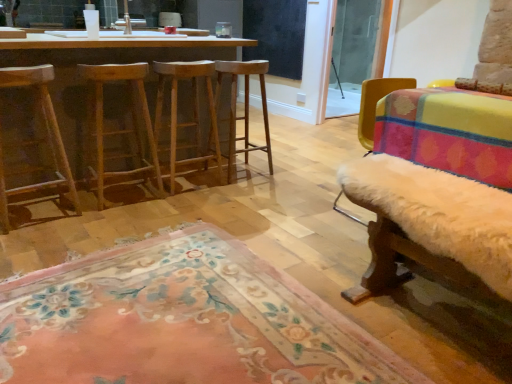
From the picture: What is the approximate height of wooden stool at center, placed as the 3th stool when sorted from left to right?

32.11 inches.

Describe the element at coordinates (244, 107) in the screenshot. I see `wooden stool at center, marked as the first stool in a right-to-left arrangement` at that location.

The height and width of the screenshot is (384, 512). What do you see at coordinates (276, 34) in the screenshot?
I see `black matte window screen at upper center` at bounding box center [276, 34].

What is the approximate height of light brown wood stool at center, which is the 2th stool in right-to-left order?

light brown wood stool at center, which is the 2th stool in right-to-left order, is 32.01 inches tall.

In order to click on wooden stool at center, marked as the first stool in a right-to-left arrangement in this screenshot , I will do `click(244, 107)`.

At what (x,y) coordinates should I click in order to perform the action: click on the 3rd stool to the left of the black matte window screen at upper center, counting from the anchor's position. Please return your answer as a coordinate pair (x, y). The width and height of the screenshot is (512, 384). Looking at the image, I should click on (119, 129).

Looking at the image, does black matte window screen at upper center seem bigger or smaller compared to natural wood stool at center, acting as the first stool starting from the left?

In the image, black matte window screen at upper center appears to be smaller than natural wood stool at center, acting as the first stool starting from the left.

From the image's perspective, who appears lower, black matte window screen at upper center or natural wood stool at center, acting as the first stool starting from the left?

From the image's view, natural wood stool at center, acting as the first stool starting from the left, is below.

Would you say black matte window screen at upper center is a long distance from natural wood stool at center, placed as the 3th stool when sorted from right to left?

Yes, black matte window screen at upper center and natural wood stool at center, placed as the 3th stool when sorted from right to left, are located far from each other.

Is wooden stool at left positioned with its back to transparent glass screen door at upper right?

No.

Is wooden stool at left next to transparent glass screen door at upper right?

No.

How many degrees apart are the facing directions of wooden stool at left and transparent glass screen door at upper right?

There is a 179-degree angle between the facing directions of wooden stool at left and transparent glass screen door at upper right.

Does point (37, 89) come behind point (344, 10)?

That is False.

From the image's perspective, is wooden stool at center, marked as the first stool in a right-to-left arrangement, under wooden barstools at left?

Indeed, from the image's perspective, wooden stool at center, marked as the first stool in a right-to-left arrangement, is shown beneath wooden barstools at left.

Measure the distance between wooden stool at center, marked as the first stool in a right-to-left arrangement, and wooden barstools at left.

wooden stool at center, marked as the first stool in a right-to-left arrangement, and wooden barstools at left are 24.74 inches apart.

Is wooden stool at center, placed as the 3th stool when sorted from left to right, in contact with wooden barstools at left?

No, wooden stool at center, placed as the 3th stool when sorted from left to right, is not with wooden barstools at left.

Is wooden stool at center, marked as the first stool in a right-to-left arrangement, to the left of wooden barstools at left from the viewer's perspective?

No, wooden stool at center, marked as the first stool in a right-to-left arrangement, is not to the left of wooden barstools at left.

Does black matte window screen at upper center have a lesser height compared to wooden stool at left?

In fact, black matte window screen at upper center may be taller than wooden stool at left.

Image resolution: width=512 pixels, height=384 pixels. I want to click on chair in front of the black matte window screen at upper center, so click(x=35, y=143).

From the image's perspective, is black matte window screen at upper center on top of wooden stool at left?

Yes, from the image's perspective, black matte window screen at upper center is above wooden stool at left.

Is black matte window screen at upper center not close to wooden stool at left?

black matte window screen at upper center is positioned a significant distance from wooden stool at left.

Does wooden stool at center, placed as the 3th stool when sorted from left to right, come in front of wooden stool at left?

No, wooden stool at center, placed as the 3th stool when sorted from left to right, is behind wooden stool at left.

Is wooden stool at left a part of wooden stool at center, placed as the 3th stool when sorted from left to right?

That's incorrect, wooden stool at left is not inside wooden stool at center, placed as the 3th stool when sorted from left to right.

Does wooden stool at center, marked as the first stool in a right-to-left arrangement, turn towards wooden stool at left?

No, wooden stool at center, marked as the first stool in a right-to-left arrangement, is not oriented towards wooden stool at left.

From the image's perspective, is transparent glass screen door at upper right below wooden stool at left?

No, from the image's perspective, transparent glass screen door at upper right is not below wooden stool at left.

Do you think transparent glass screen door at upper right is within wooden stool at left, or outside of it?

transparent glass screen door at upper right is not inside wooden stool at left, it's outside.

Is transparent glass screen door at upper right not close to wooden stool at left?

Yes.

Considering the relative positions of transparent glass screen door at upper right and wooden stool at left in the image provided, is transparent glass screen door at upper right to the right of wooden stool at left from the viewer's perspective?

Yes, transparent glass screen door at upper right is to the right of wooden stool at left.

From the image's perspective, between light brown wood stool at center, which is the 2th stool in right-to-left order, and wooden stool at center, marked as the first stool in a right-to-left arrangement, which one is located above?

wooden stool at center, marked as the first stool in a right-to-left arrangement, is shown above in the image.

In the scene shown: From a real-world perspective, is light brown wood stool at center, which is the 2th stool in right-to-left order, positioned above or below wooden stool at center, marked as the first stool in a right-to-left arrangement?

Clearly, from a real-world perspective, light brown wood stool at center, which is the 2th stool in right-to-left order, is above wooden stool at center, marked as the first stool in a right-to-left arrangement.

Considering the sizes of objects light brown wood stool at center, the second stool positioned from the left, and wooden stool at center, marked as the first stool in a right-to-left arrangement, in the image provided, who is bigger, light brown wood stool at center, the second stool positioned from the left, or wooden stool at center, marked as the first stool in a right-to-left arrangement,?

wooden stool at center, marked as the first stool in a right-to-left arrangement.

Is light brown wood stool at center, the second stool positioned from the left, far from wooden stool at center, marked as the first stool in a right-to-left arrangement?

No, light brown wood stool at center, the second stool positioned from the left, is not far away from wooden stool at center, marked as the first stool in a right-to-left arrangement.

Find the location of a particular element. This screenshot has height=384, width=512. the 2nd stool located beneath the black matte window screen at upper center (from a real-world perspective) is located at coordinates (119, 129).

Image resolution: width=512 pixels, height=384 pixels. Identify the location of screen door above the wooden stool at left (from the image's perspective). (353, 53).

Looking at the image, which one is located further to floral rug at lower center, wooden stool at left or black matte window screen at upper center?

Among the two, black matte window screen at upper center is located further to floral rug at lower center.

When comparing their distances from wooden stool at center, placed as the 3th stool when sorted from left to right, does light brown wood stool at center, which is the 2th stool in right-to-left order, or natural wood stool at center, acting as the first stool starting from the left, seem further?

Based on the image, natural wood stool at center, acting as the first stool starting from the left, appears to be further to wooden stool at center, placed as the 3th stool when sorted from left to right.

When comparing their distances from black matte window screen at upper center, does floral rug at lower center or natural wood stool at center, placed as the 3th stool when sorted from right to left, seem further?

floral rug at lower center lies further to black matte window screen at upper center than the other object.

When comparing their distances from transparent glass screen door at upper right, does black matte window screen at upper center or wooden barstools at left seem closer?

Based on the image, black matte window screen at upper center appears to be nearer to transparent glass screen door at upper right.

From the image, which object appears to be nearer to wooden stool at left, transparent glass screen door at upper right or floral rug at lower center?

floral rug at lower center is positioned closer to the anchor wooden stool at left.

When comparing their distances from wooden stool at center, marked as the first stool in a right-to-left arrangement, does natural wood stool at center, acting as the first stool starting from the left, or transparent glass screen door at upper right seem further?

transparent glass screen door at upper right lies further to wooden stool at center, marked as the first stool in a right-to-left arrangement, than the other object.

Estimate the real-world distances between objects in this image. Which object is further from transparent glass screen door at upper right, wooden stool at center, marked as the first stool in a right-to-left arrangement, or natural wood stool at center, acting as the first stool starting from the left?

Among the two, natural wood stool at center, acting as the first stool starting from the left, is located further to transparent glass screen door at upper right.

Looking at the image, which one is located further to natural wood stool at center, placed as the 3th stool when sorted from right to left, black matte window screen at upper center or floral rug at lower center?

Based on the image, black matte window screen at upper center appears to be further to natural wood stool at center, placed as the 3th stool when sorted from right to left.

What are the coordinates of `desk situated between wooden stool at left and light brown wood stool at center, which is the 2th stool in right-to-left order, from left to right` in the screenshot? It's located at (106, 56).

The width and height of the screenshot is (512, 384). What are the coordinates of `desk between wooden stool at left and transparent glass screen door at upper right from front to back` in the screenshot? It's located at (106, 56).

The height and width of the screenshot is (384, 512). What are the coordinates of `stool between natural wood stool at center, acting as the first stool starting from the left, and wooden stool at center, placed as the 3th stool when sorted from left to right, in the horizontal direction` in the screenshot? It's located at (x=194, y=107).

Find the location of a particular element. chair between floral rug at lower center and transparent glass screen door at upper right from front to back is located at coordinates (35, 143).